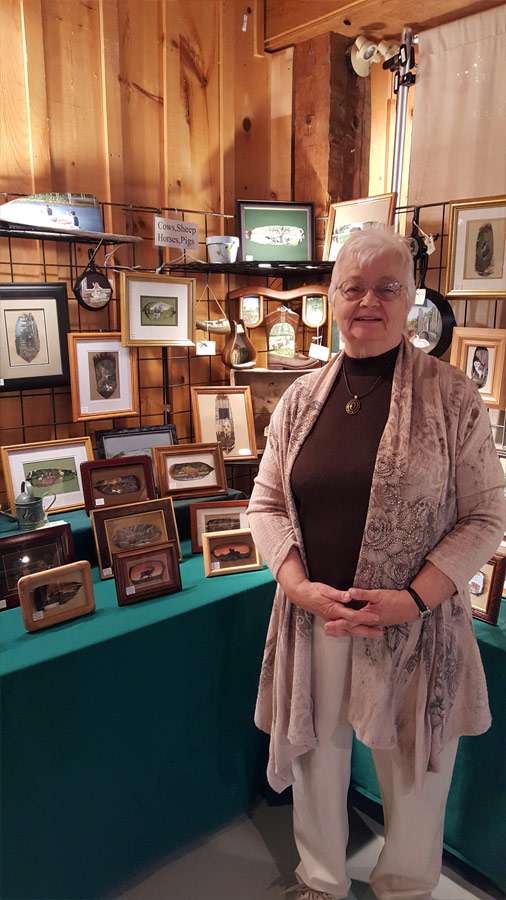
Find the location of a particular element. The image size is (506, 900). frame is located at coordinates 226,425.